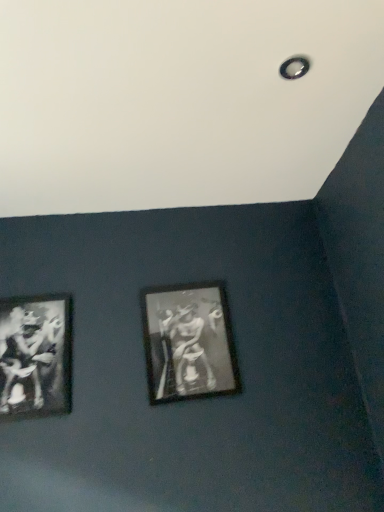
This screenshot has height=512, width=384. What do you see at coordinates (35, 356) in the screenshot? I see `black matte picture frame at lower left, which is counted as the 2th picture frame, starting from the right` at bounding box center [35, 356].

This screenshot has height=512, width=384. Identify the location of black matte picture frame at lower left, the first picture frame from the left. (35, 356).

What are the coordinates of `black matte picture frame at center, positioned as the 2th picture frame in left-to-right order` in the screenshot? It's located at (188, 342).

Describe the element at coordinates (188, 342) in the screenshot. This screenshot has width=384, height=512. I see `black matte picture frame at center, arranged as the first picture frame when viewed from the right` at that location.

The image size is (384, 512). In order to click on black matte picture frame at lower left, which is counted as the 2th picture frame, starting from the right in this screenshot , I will do `click(35, 356)`.

Based on their positions, is black matte picture frame at center, arranged as the first picture frame when viewed from the right, located to the left or right of black matte picture frame at lower left, the first picture frame from the left?

From the image, it's evident that black matte picture frame at center, arranged as the first picture frame when viewed from the right, is to the right of black matte picture frame at lower left, the first picture frame from the left.

Looking at this image, which object is closer to the camera taking this photo, black matte picture frame at center, positioned as the 2th picture frame in left-to-right order, or black matte picture frame at lower left, which is counted as the 2th picture frame, starting from the right?

black matte picture frame at lower left, which is counted as the 2th picture frame, starting from the right, is in front.

Is point (219, 293) closer or farther from the camera than point (34, 382)?

Point (219, 293).

From the image's perspective, between black matte picture frame at center, positioned as the 2th picture frame in left-to-right order, and black matte picture frame at lower left, the first picture frame from the left, which one is located above?

black matte picture frame at center, positioned as the 2th picture frame in left-to-right order, appears higher in the image.

From a real-world perspective, is black matte picture frame at center, positioned as the 2th picture frame in left-to-right order, beneath black matte picture frame at lower left, the first picture frame from the left?

Yes, from a real-world perspective, black matte picture frame at center, positioned as the 2th picture frame in left-to-right order, is beneath black matte picture frame at lower left, the first picture frame from the left.

Which object is thinner, black matte picture frame at center, arranged as the first picture frame when viewed from the right, or black matte picture frame at lower left, which is counted as the 2th picture frame, starting from the right?

With smaller width is black matte picture frame at lower left, which is counted as the 2th picture frame, starting from the right.

Considering the relative sizes of black matte picture frame at center, positioned as the 2th picture frame in left-to-right order, and black matte picture frame at lower left, the first picture frame from the left, in the image provided, is black matte picture frame at center, positioned as the 2th picture frame in left-to-right order, shorter than black matte picture frame at lower left, the first picture frame from the left,?

In fact, black matte picture frame at center, positioned as the 2th picture frame in left-to-right order, may be taller than black matte picture frame at lower left, the first picture frame from the left.

Based on their sizes in the image, would you say black matte picture frame at center, arranged as the first picture frame when viewed from the right, is bigger or smaller than black matte picture frame at lower left, which is counted as the 2th picture frame, starting from the right?

Considering their sizes, black matte picture frame at center, arranged as the first picture frame when viewed from the right, takes up more space than black matte picture frame at lower left, which is counted as the 2th picture frame, starting from the right.

Is black matte picture frame at center, positioned as the 2th picture frame in left-to-right order, inside the boundaries of black matte picture frame at lower left, the first picture frame from the left, or outside?

The correct answer is: outside.

Is black matte picture frame at center, arranged as the first picture frame when viewed from the right, beside black matte picture frame at lower left, which is counted as the 2th picture frame, starting from the right?

No, black matte picture frame at center, arranged as the first picture frame when viewed from the right, is not next to black matte picture frame at lower left, which is counted as the 2th picture frame, starting from the right.

Is black matte picture frame at center, positioned as the 2th picture frame in left-to-right order, positioned with its back to black matte picture frame at lower left, which is counted as the 2th picture frame, starting from the right?

No, black matte picture frame at lower left, which is counted as the 2th picture frame, starting from the right, is not at the back of black matte picture frame at center, positioned as the 2th picture frame in left-to-right order.

Measure the distance from black matte picture frame at center, positioned as the 2th picture frame in left-to-right order, to black matte picture frame at lower left, the first picture frame from the left.

black matte picture frame at center, positioned as the 2th picture frame in left-to-right order, is 16.82 inches away from black matte picture frame at lower left, the first picture frame from the left.

Find the location of a particular element. This screenshot has height=512, width=384. picture frame that is above the black matte picture frame at center, arranged as the first picture frame when viewed from the right (from a real-world perspective) is located at coordinates (35, 356).

Is black matte picture frame at lower left, which is counted as the 2th picture frame, starting from the right, to the left or to the right of black matte picture frame at center, positioned as the 2th picture frame in left-to-right order, in the image?

Clearly, black matte picture frame at lower left, which is counted as the 2th picture frame, starting from the right, is on the left of black matte picture frame at center, positioned as the 2th picture frame in left-to-right order, in the image.

In the scene shown: Relative to black matte picture frame at center, positioned as the 2th picture frame in left-to-right order, is black matte picture frame at lower left, which is counted as the 2th picture frame, starting from the right, in front or behind?

black matte picture frame at lower left, which is counted as the 2th picture frame, starting from the right, is in front of black matte picture frame at center, positioned as the 2th picture frame in left-to-right order.

Which point is more forward, (19, 353) or (174, 354)?

The point (19, 353) is more forward.

From the image's perspective, is black matte picture frame at lower left, which is counted as the 2th picture frame, starting from the right, located above or below black matte picture frame at center, arranged as the first picture frame when viewed from the right?

black matte picture frame at lower left, which is counted as the 2th picture frame, starting from the right, is situated lower than black matte picture frame at center, arranged as the first picture frame when viewed from the right, in the image.

From a real-world perspective, is black matte picture frame at lower left, the first picture frame from the left, located beneath black matte picture frame at center, positioned as the 2th picture frame in left-to-right order?

No, from a real-world perspective, black matte picture frame at lower left, the first picture frame from the left, is not under black matte picture frame at center, positioned as the 2th picture frame in left-to-right order.

Between black matte picture frame at lower left, which is counted as the 2th picture frame, starting from the right, and black matte picture frame at center, positioned as the 2th picture frame in left-to-right order, which one has larger width?

With larger width is black matte picture frame at center, positioned as the 2th picture frame in left-to-right order.

Can you confirm if black matte picture frame at lower left, which is counted as the 2th picture frame, starting from the right, is taller than black matte picture frame at center, positioned as the 2th picture frame in left-to-right order?

No.

Is black matte picture frame at lower left, the first picture frame from the left, smaller than black matte picture frame at center, positioned as the 2th picture frame in left-to-right order?

Correct, black matte picture frame at lower left, the first picture frame from the left, occupies less space than black matte picture frame at center, positioned as the 2th picture frame in left-to-right order.

Which is correct: black matte picture frame at lower left, which is counted as the 2th picture frame, starting from the right, is inside black matte picture frame at center, arranged as the first picture frame when viewed from the right, or outside of it?

black matte picture frame at lower left, which is counted as the 2th picture frame, starting from the right, cannot be found inside black matte picture frame at center, arranged as the first picture frame when viewed from the right.

Is black matte picture frame at lower left, which is counted as the 2th picture frame, starting from the right, not near black matte picture frame at center, positioned as the 2th picture frame in left-to-right order?

They are positioned close to each other.

Is black matte picture frame at lower left, the first picture frame from the left, looking in the opposite direction of black matte picture frame at center, positioned as the 2th picture frame in left-to-right order?

No, black matte picture frame at center, positioned as the 2th picture frame in left-to-right order, is not at the back of black matte picture frame at lower left, the first picture frame from the left.

How much distance is there between black matte picture frame at lower left, the first picture frame from the left, and black matte picture frame at center, positioned as the 2th picture frame in left-to-right order?

black matte picture frame at lower left, the first picture frame from the left, is 42.72 centimeters away from black matte picture frame at center, positioned as the 2th picture frame in left-to-right order.

The image size is (384, 512). What are the coordinates of `picture frame in front of the black matte picture frame at center, arranged as the first picture frame when viewed from the right` in the screenshot? It's located at (35, 356).

Locate an element on the screen. Image resolution: width=384 pixels, height=512 pixels. picture frame located behind the black matte picture frame at lower left, which is counted as the 2th picture frame, starting from the right is located at coordinates (188, 342).

Image resolution: width=384 pixels, height=512 pixels. What are the coordinates of `picture frame lying on the right of black matte picture frame at lower left, the first picture frame from the left` in the screenshot? It's located at (188, 342).